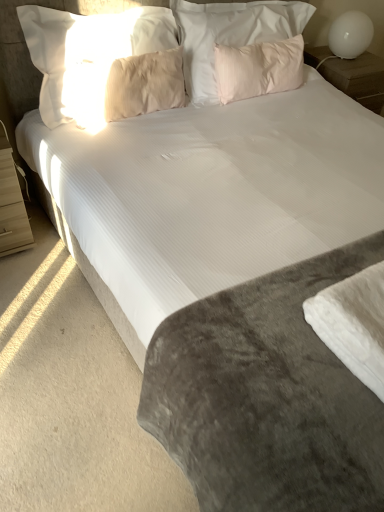
You are a GUI agent. You are given a task and a screenshot of the screen. Output one action in this format:
    pyautogui.click(x=<x>, y=<y>)
    Task: Click on the white glossy table lamp at upper right
    The image size is (384, 512).
    Given the screenshot: What is the action you would take?
    pyautogui.click(x=350, y=34)

What is the approximate height of pink soft pillow at upper center, which appears as the 4th pillow when viewed from the left?

It is 9.48 inches.

Image resolution: width=384 pixels, height=512 pixels. Describe the element at coordinates (11, 203) in the screenshot. I see `light wood nightstand at left, the 1th nightstand in the bottom-to-top sequence` at that location.

In order to click on pink soft pillow at upper center, arranged as the 2th pillow when viewed from the right in this screenshot , I will do [x=229, y=35].

The height and width of the screenshot is (512, 384). Identify the location of white soft fabric at lower right. (353, 323).

Is velvety gray mattress at center oriented towards beige soft pillow at upper center, the 1th pillow in the left-to-right sequence?

No, velvety gray mattress at center is not oriented towards beige soft pillow at upper center, the 1th pillow in the left-to-right sequence.

Which of these two, velvety gray mattress at center or beige soft pillow at upper center, the fourth pillow in the right-to-left sequence, stands shorter?

With less height is beige soft pillow at upper center, the fourth pillow in the right-to-left sequence.

Can you confirm if velvety gray mattress at center is positioned to the right of beige soft pillow at upper center, the fourth pillow in the right-to-left sequence?

Indeed, velvety gray mattress at center is positioned on the right side of beige soft pillow at upper center, the fourth pillow in the right-to-left sequence.

Is velvety gray mattress at center positioned in front of beige soft pillow at upper center, the fourth pillow in the right-to-left sequence?

Yes, velvety gray mattress at center is closer to the camera.

Does light wood nightstand at left, the 1th nightstand when ordered from front to back, turn towards pink soft pillow at upper center, arranged as the 2th pillow when viewed from the right?

No, light wood nightstand at left, the 1th nightstand when ordered from front to back, does not turn towards pink soft pillow at upper center, arranged as the 2th pillow when viewed from the right.

Does light wood nightstand at left, arranged as the second nightstand when viewed from the top, touch pink soft pillow at upper center, marked as the third pillow in a left-to-right arrangement?

light wood nightstand at left, arranged as the second nightstand when viewed from the top, and pink soft pillow at upper center, marked as the third pillow in a left-to-right arrangement, are not in contact.

From the image's perspective, would you say light wood nightstand at left, which is the 2th nightstand in right-to-left order, is positioned over pink soft pillow at upper center, arranged as the 2th pillow when viewed from the right?

No, from the image's perspective, light wood nightstand at left, which is the 2th nightstand in right-to-left order, is not on top of pink soft pillow at upper center, arranged as the 2th pillow when viewed from the right.

Based on their positions, is light wood nightstand at left, arranged as the second nightstand when viewed from the top, located to the left or right of pink soft pillow at upper center, marked as the third pillow in a left-to-right arrangement?

In the image, light wood nightstand at left, arranged as the second nightstand when viewed from the top, appears on the left side of pink soft pillow at upper center, marked as the third pillow in a left-to-right arrangement.

Does beige soft pillow at upper left, the second pillow viewed from the left, come behind light wood nightstand at left, the 1th nightstand in the bottom-to-top sequence?

Yes.

Is beige soft pillow at upper left, placed as the third pillow when sorted from right to left, outside of light wood nightstand at left, marked as the 2th nightstand in a back-to-front arrangement?

beige soft pillow at upper left, placed as the third pillow when sorted from right to left, is positioned outside light wood nightstand at left, marked as the 2th nightstand in a back-to-front arrangement.

Would you consider beige soft pillow at upper left, placed as the third pillow when sorted from right to left, to be distant from light wood nightstand at left, marked as the 2th nightstand in a back-to-front arrangement?

That's not correct — beige soft pillow at upper left, placed as the third pillow when sorted from right to left, is a little close to light wood nightstand at left, marked as the 2th nightstand in a back-to-front arrangement.

In the scene shown: Is beige soft pillow at upper center, the fourth pillow in the right-to-left sequence, not within white glossy nightstand at upper right, the 2th nightstand from the left?

beige soft pillow at upper center, the fourth pillow in the right-to-left sequence, is positioned outside white glossy nightstand at upper right, the 2th nightstand from the left.

Is beige soft pillow at upper center, the 1th pillow in the left-to-right sequence, facing towards white glossy nightstand at upper right, which is the 1th nightstand in right-to-left order?

No, beige soft pillow at upper center, the 1th pillow in the left-to-right sequence, does not turn towards white glossy nightstand at upper right, which is the 1th nightstand in right-to-left order.

Between beige soft pillow at upper center, the 1th pillow in the left-to-right sequence, and white glossy nightstand at upper right, the first nightstand viewed from the top, which one has more height?

beige soft pillow at upper center, the 1th pillow in the left-to-right sequence.

The height and width of the screenshot is (512, 384). Find the location of `the 1st nightstand below the beige soft pillow at upper center, the 1th pillow in the left-to-right sequence (from a real-world perspective)`. the 1st nightstand below the beige soft pillow at upper center, the 1th pillow in the left-to-right sequence (from a real-world perspective) is located at coordinates (351, 75).

Does beige soft pillow at upper left, placed as the third pillow when sorted from right to left, have a smaller size compared to white glossy table lamp at upper right?

No.

Is beige soft pillow at upper left, the second pillow viewed from the left, positioned with its back to white glossy table lamp at upper right?

beige soft pillow at upper left, the second pillow viewed from the left, does not have its back to white glossy table lamp at upper right.

Does beige soft pillow at upper left, placed as the third pillow when sorted from right to left, have a greater width compared to white glossy table lamp at upper right?

Incorrect, the width of beige soft pillow at upper left, placed as the third pillow when sorted from right to left, does not surpass that of white glossy table lamp at upper right.

Looking at this image, is beige soft pillow at upper left, placed as the third pillow when sorted from right to left, positioned far away from white glossy table lamp at upper right?

Yes.

From a real-world perspective, between white glossy nightstand at upper right, the first nightstand viewed from the top, and beige soft pillow at upper left, placed as the third pillow when sorted from right to left, who is vertically higher?

beige soft pillow at upper left, placed as the third pillow when sorted from right to left.

Find the location of a particular element. the 3rd pillow positioned below the white glossy nightstand at upper right, the 2th nightstand ordered from the bottom (from the image's perspective) is located at coordinates [123, 88].

Based on the photo, from the image's perspective, between white glossy nightstand at upper right, the 2th nightstand ordered from the bottom, and beige soft pillow at upper left, placed as the third pillow when sorted from right to left, which one is located above?

white glossy nightstand at upper right, the 2th nightstand ordered from the bottom, from the image's perspective.

Does white glossy nightstand at upper right, the first nightstand viewed from the top, have a lesser height compared to beige soft pillow at upper center, the fourth pillow in the right-to-left sequence?

Indeed, white glossy nightstand at upper right, the first nightstand viewed from the top, has a lesser height compared to beige soft pillow at upper center, the fourth pillow in the right-to-left sequence.

Measure the distance between white glossy nightstand at upper right, the 2th nightstand from the left, and beige soft pillow at upper center, the fourth pillow in the right-to-left sequence.

white glossy nightstand at upper right, the 2th nightstand from the left, is 4.06 feet from beige soft pillow at upper center, the fourth pillow in the right-to-left sequence.

Based on the photo, is white glossy nightstand at upper right, positioned as the 2th nightstand in front-to-back order, completely or partially outside of beige soft pillow at upper center, the 1th pillow in the left-to-right sequence?

Absolutely, white glossy nightstand at upper right, positioned as the 2th nightstand in front-to-back order, is external to beige soft pillow at upper center, the 1th pillow in the left-to-right sequence.

Is white glossy nightstand at upper right, the 2th nightstand from the left, looking in the opposite direction of beige soft pillow at upper center, the fourth pillow in the right-to-left sequence?

No, beige soft pillow at upper center, the fourth pillow in the right-to-left sequence, is not at the back of white glossy nightstand at upper right, the 2th nightstand from the left.

I want to click on mattress below the beige soft pillow at upper center, the fourth pillow in the right-to-left sequence (from the image's perspective), so click(266, 397).

What are the coordinates of `nightstand in front of the pink soft pillow at upper center, marked as the third pillow in a left-to-right arrangement` in the screenshot? It's located at click(x=11, y=203).

Based on their spatial positions, is pink soft pillow at upper center, marked as the first pillow in a right-to-left arrangement, or velvety gray mattress at center further from pink soft pillow at upper center, arranged as the 2th pillow when viewed from the right?

velvety gray mattress at center is further to pink soft pillow at upper center, arranged as the 2th pillow when viewed from the right.

Which object lies nearer to the anchor point pink soft pillow at upper center, marked as the third pillow in a left-to-right arrangement, white glossy table lamp at upper right or pink soft pillow at upper center, which appears as the 4th pillow when viewed from the left?

Among the two, pink soft pillow at upper center, which appears as the 4th pillow when viewed from the left, is located nearer to pink soft pillow at upper center, marked as the third pillow in a left-to-right arrangement.

Which object lies nearer to the anchor point light wood nightstand at left, the 1th nightstand when ordered from front to back, pink soft pillow at upper center, arranged as the 2th pillow when viewed from the right, or white glossy nightstand at upper right, the first nightstand viewed from the top?

pink soft pillow at upper center, arranged as the 2th pillow when viewed from the right.

Which object lies further to the anchor point pink soft pillow at upper center, marked as the third pillow in a left-to-right arrangement, light wood nightstand at left, arranged as the second nightstand when viewed from the top, or white glossy table lamp at upper right?

light wood nightstand at left, arranged as the second nightstand when viewed from the top, lies further to pink soft pillow at upper center, marked as the third pillow in a left-to-right arrangement, than the other object.

Considering their positions, is beige soft pillow at upper center, the fourth pillow in the right-to-left sequence, positioned closer to white glossy table lamp at upper right than pink soft pillow at upper center, marked as the first pillow in a right-to-left arrangement?

Based on the image, pink soft pillow at upper center, marked as the first pillow in a right-to-left arrangement, appears to be nearer to white glossy table lamp at upper right.

Which object lies further to the anchor point white soft fabric at lower right, beige soft pillow at upper left, placed as the third pillow when sorted from right to left, or beige soft pillow at upper center, the 1th pillow in the left-to-right sequence?

The object further to white soft fabric at lower right is beige soft pillow at upper center, the 1th pillow in the left-to-right sequence.

Considering their positions, is beige soft pillow at upper center, the 1th pillow in the left-to-right sequence, positioned closer to white soft fabric at lower right than light wood nightstand at left, the 1th nightstand when ordered from front to back?

light wood nightstand at left, the 1th nightstand when ordered from front to back, is closer to white soft fabric at lower right.

When comparing their distances from beige soft pillow at upper left, the second pillow viewed from the left, does beige soft pillow at upper center, the 1th pillow in the left-to-right sequence, or white glossy table lamp at upper right seem further?

white glossy table lamp at upper right.

The image size is (384, 512). I want to click on table lamp between pink soft pillow at upper center, marked as the first pillow in a right-to-left arrangement, and white glossy nightstand at upper right, the first nightstand viewed from the top, from left to right, so click(x=350, y=34).

Where is `pillow between beige soft pillow at upper center, the fourth pillow in the right-to-left sequence, and pink soft pillow at upper center, arranged as the 2th pillow when viewed from the right, in the horizontal direction`? The height and width of the screenshot is (512, 384). pillow between beige soft pillow at upper center, the fourth pillow in the right-to-left sequence, and pink soft pillow at upper center, arranged as the 2th pillow when viewed from the right, in the horizontal direction is located at coordinates (123, 88).

Find the location of a particular element. This screenshot has height=512, width=384. sheet between beige soft pillow at upper center, the fourth pillow in the right-to-left sequence, and velvety gray mattress at center, in the vertical direction is located at coordinates (353, 323).

Identify the location of pillow between beige soft pillow at upper center, the fourth pillow in the right-to-left sequence, and white soft fabric at lower right vertically. This screenshot has height=512, width=384. (123, 88).